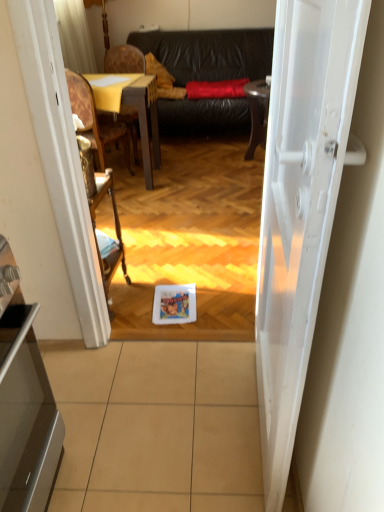
The height and width of the screenshot is (512, 384). Find the location of `vacant area that lies to the right of wooden armchair at center`. vacant area that lies to the right of wooden armchair at center is located at coordinates (153, 298).